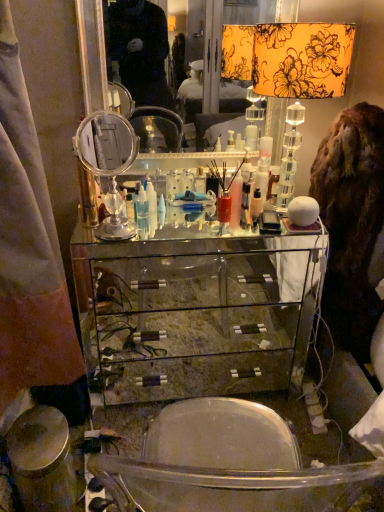
Question: Would you say clear glass mirror at center is a long distance from brown furry coat at right?

Choices:
 (A) yes
 (B) no

Answer: (A)

Question: Is clear glass mirror at center completely or partially outside of brown furry coat at right?

Choices:
 (A) yes
 (B) no

Answer: (A)

Question: Can you confirm if clear glass mirror at center is thinner than brown furry coat at right?

Choices:
 (A) no
 (B) yes

Answer: (B)

Question: Does clear glass mirror at center touch brown furry coat at right?

Choices:
 (A) yes
 (B) no

Answer: (B)

Question: Does clear glass mirror at center have a larger size compared to brown furry coat at right?

Choices:
 (A) no
 (B) yes

Answer: (A)

Question: From a real-world perspective, is clear glass mirror at center on top of brown furry coat at right?

Choices:
 (A) no
 (B) yes

Answer: (B)

Question: Is there a large distance between clear glass mirror at center and clear glass cabinet at center?

Choices:
 (A) yes
 (B) no

Answer: (A)

Question: Is clear glass mirror at center positioned beyond the bounds of clear glass cabinet at center?

Choices:
 (A) no
 (B) yes

Answer: (B)

Question: Can you confirm if clear glass mirror at center is positioned to the right of clear glass cabinet at center?

Choices:
 (A) yes
 (B) no

Answer: (B)

Question: From a real-world perspective, is clear glass mirror at center physically below clear glass cabinet at center?

Choices:
 (A) no
 (B) yes

Answer: (A)

Question: Does clear glass mirror at center appear on the left side of clear glass cabinet at center?

Choices:
 (A) yes
 (B) no

Answer: (A)

Question: Is clear glass mirror at center aimed at clear glass cabinet at center?

Choices:
 (A) yes
 (B) no

Answer: (B)

Question: Can brown furry coat at right be found inside polished silver mirror at center, the first table lamp in the left-to-right sequence?

Choices:
 (A) no
 (B) yes

Answer: (A)